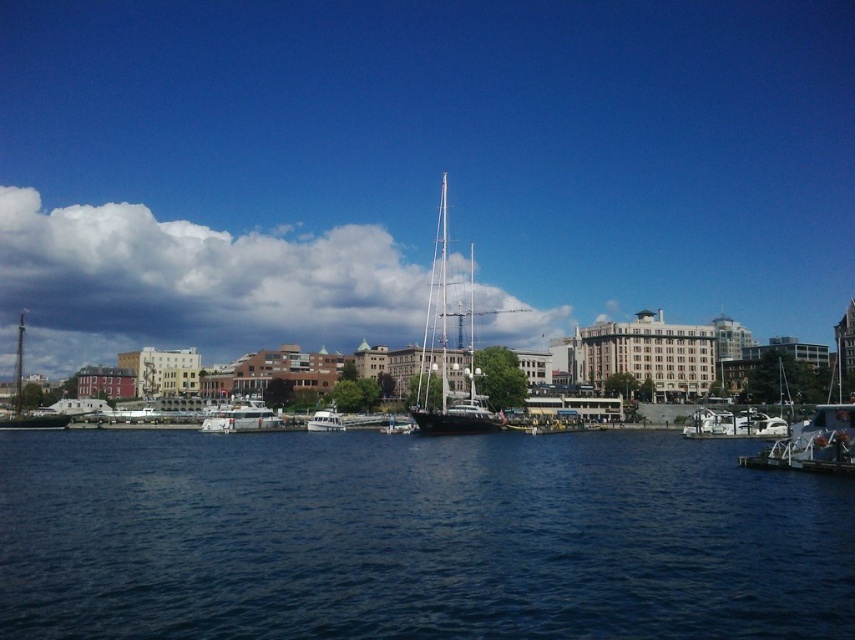
Question: Which point is farther to the camera?

Choices:
 (A) white glossy boat at left
 (B) shiny black sailboat at center
 (C) white matte boat at center
 (D) white glossy sailboat at center

Answer: (C)

Question: Is white fluffy cloud at upper center above white glossy boat at lower right?

Choices:
 (A) yes
 (B) no

Answer: (A)

Question: Which point is farther to the camera?

Choices:
 (A) (x=243, y=404)
 (B) (x=500, y=422)
 (C) (x=404, y=420)
 (D) (x=314, y=413)

Answer: (A)

Question: Can you confirm if dark blue water at center is smaller than shiny black sailboat at center?

Choices:
 (A) no
 (B) yes

Answer: (B)

Question: In this image, where is white fluffy cloud at upper center located relative to white glossy boat at lower right?

Choices:
 (A) right
 (B) left

Answer: (B)

Question: Which is nearer to the shiny black sailboat at center?

Choices:
 (A) white glossy sailboat at center
 (B) metallic silver sailboat at right
 (C) white fluffy cloud at upper center
 (D) white matte boat at center

Answer: (A)